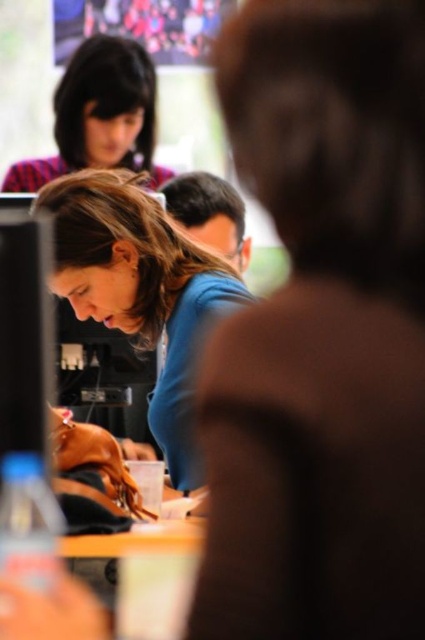
You are a photographer setting up for a group photo. You want to ensure that both the blue matte shirt at center and the plaid fabric headscarf at upper left are clearly visible in the shot. Based on their positions, which object should you focus on first to ensure both are in focus?

The blue matte shirt at center is in front of the plaid fabric headscarf at upper left, so you should focus on the blue matte shirt at center first to ensure both are in focus.

You are a photographer trying to capture a clear shot of both the blue matte shirt at center and the plaid fabric headscarf at upper left. Based on their positions, which object would appear larger in your photo?

The blue matte shirt at center appears larger in the photo because it is closer to the camera than the plaid fabric headscarf at upper left, making it taller in the image.

You are an observer looking at the scene. There is a blue matte shirt at center and a plaid fabric headscarf at upper left. Which object is positioned lower in the image?

The blue matte shirt at center is positioned lower than the plaid fabric headscarf at upper left.